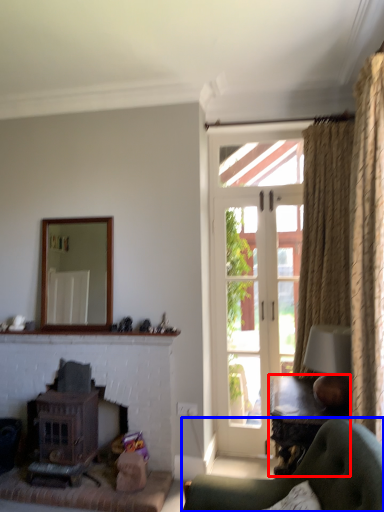
Question: Which object appears farthest to the camera in this image, table (highlighted by a red box) or chair (highlighted by a blue box)?

Choices:
 (A) table
 (B) chair

Answer: (A)